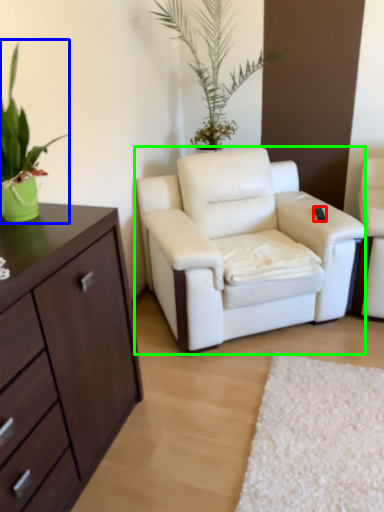
Question: Considering the real-world distances, which object is farthest from remote control (highlighted by a red box)? houseplant (highlighted by a blue box) or chair (highlighted by a green box)?

Choices:
 (A) houseplant
 (B) chair

Answer: (A)